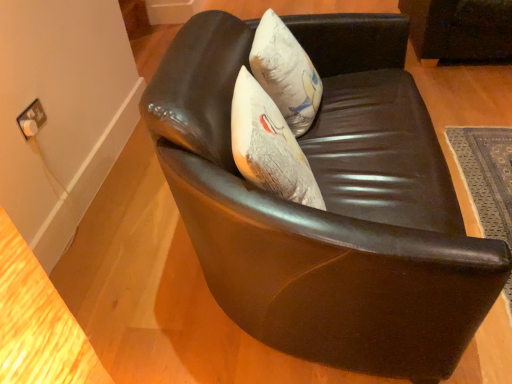
Question: Does point (320, 99) appear closer or farther from the camera than point (484, 200)?

Choices:
 (A) closer
 (B) farther

Answer: (A)

Question: Would you say white fabric pillow at center is inside or outside dark gray woven mat at lower right?

Choices:
 (A) inside
 (B) outside

Answer: (B)

Question: Which is farther from the shiny black leather chair at center?

Choices:
 (A) white fabric pillow at center
 (B) dark gray woven mat at lower right

Answer: (B)

Question: Estimate the real-world distances between objects in this image. Which object is closer to the white fabric pillow at center?

Choices:
 (A) shiny black leather chair at center
 (B) dark gray woven mat at lower right

Answer: (A)